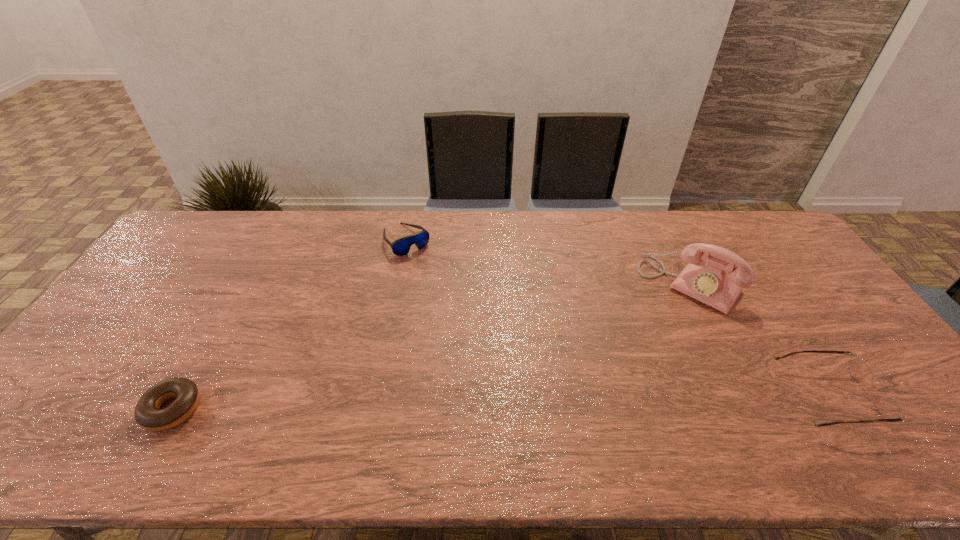
The height and width of the screenshot is (540, 960). I want to click on vacant area that lies between the doughnut and the spectacles, so click(500, 403).

Where is `free area in between the spectacles and the telephone`? The width and height of the screenshot is (960, 540). free area in between the spectacles and the telephone is located at coordinates (758, 341).

Identify which object is the second nearest to the doughnut. Please provide its 2D coordinates. Your answer should be formatted as a tuple, i.e. [(x, y)], where the tuple contains the x and y coordinates of a point satisfying the conditions above.

[(709, 284)]

The image size is (960, 540). What are the coordinates of `object that is the second closest to the leftmost object` in the screenshot? It's located at (709, 284).

Locate an element on the screen. The image size is (960, 540). vacant area in the image that satisfies the following two spatial constraints: 1. on the back side of the shortest object; 2. on the left side of the tallest object is located at coordinates (243, 284).

At what (x,y) coordinates should I click in order to perform the action: click on vacant space that satisfies the following two spatial constraints: 1. on the front side of the tallest object; 2. on the right side of the third object from right to left. Please return your answer as a coordinate pair (x, y). The width and height of the screenshot is (960, 540). Looking at the image, I should click on (397, 284).

Where is `free space that satisfies the following two spatial constraints: 1. on the back side of the spectacles; 2. on the front-facing side of the shortest object`? The image size is (960, 540). free space that satisfies the following two spatial constraints: 1. on the back side of the spectacles; 2. on the front-facing side of the shortest object is located at coordinates (180, 397).

Where is `vacant space that satisfies the following two spatial constraints: 1. on the front side of the spectacles; 2. on the front-facing side of the telephone`? The image size is (960, 540). vacant space that satisfies the following two spatial constraints: 1. on the front side of the spectacles; 2. on the front-facing side of the telephone is located at coordinates (746, 397).

I want to click on vacant space that satisfies the following two spatial constraints: 1. on the front side of the tallest object; 2. on the left side of the sunglasses, so click(x=397, y=284).

Locate an element on the screen. The image size is (960, 540). free space that satisfies the following two spatial constraints: 1. on the front side of the spectacles; 2. on the front-facing side of the sunglasses is located at coordinates (375, 397).